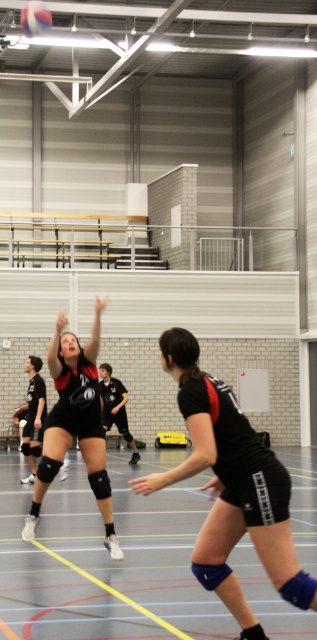
You are a volleyball coach observing the game. The court is 12.64 meters long. You want to ensure the ball stays within the court boundaries during play. Given the distance between the rubberized black volleyball court at center and the white matte volleyball at upper left, is the ball currently within the court boundaries?

The rubberized black volleyball court at center and the white matte volleyball at upper left are 12.64 meters apart. Since the court is 12.64 meters long, the ball is at the edge of the court boundaries.

You are a volleyball coach standing in the gymnasium and want to place a marker at point (4, 557). The marker needs to be exactly 10 meters away from where you are standing. Is the point 0.873, 0.13 already the correct distance away?

The distance between point (4, 557) and the viewer is 9.17 meters, so the point is not yet 10 meters away. You need to move the marker further away by 0.83 meters to reach the desired distance.